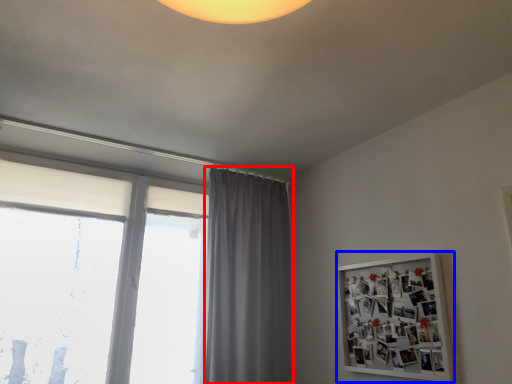
Question: Which point is further to the camera, curtain (highlighted by a red box) or bulletin board (highlighted by a blue box)?

Choices:
 (A) curtain
 (B) bulletin board

Answer: (A)